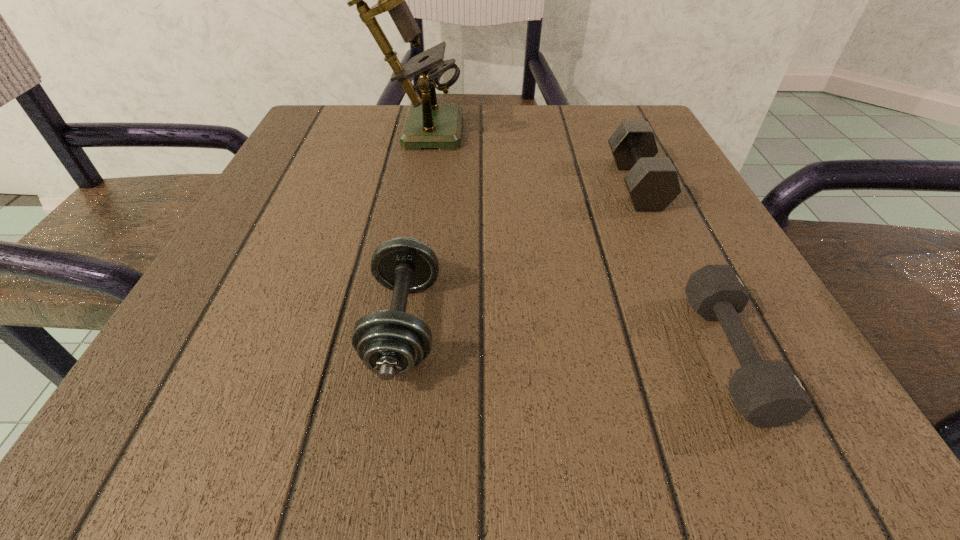
This screenshot has width=960, height=540. I want to click on dumbbell that is at the far edge, so click(652, 183).

The width and height of the screenshot is (960, 540). I want to click on object that is at the left edge, so click(x=428, y=124).

Where is `object that is at the far left corner`? The image size is (960, 540). object that is at the far left corner is located at coordinates (428, 124).

The width and height of the screenshot is (960, 540). Identify the location of object located at the far right corner. (652, 183).

The image size is (960, 540). Find the location of `object present at the near right corner`. object present at the near right corner is located at coordinates (768, 393).

The image size is (960, 540). What are the coordinates of `vacant region at the far edge of the desktop` in the screenshot? It's located at (550, 150).

In the image, there is a desktop. What are the coordinates of `free region at the near edge` in the screenshot? It's located at (343, 436).

Locate an element on the screen. This screenshot has height=540, width=960. free space at the left edge of the desktop is located at coordinates tap(239, 291).

Where is `vacant space at the right edge of the desktop`? This screenshot has width=960, height=540. vacant space at the right edge of the desktop is located at coordinates (710, 352).

Find the location of a particular element. The width and height of the screenshot is (960, 540). vacant region at the far left corner of the desktop is located at coordinates (316, 124).